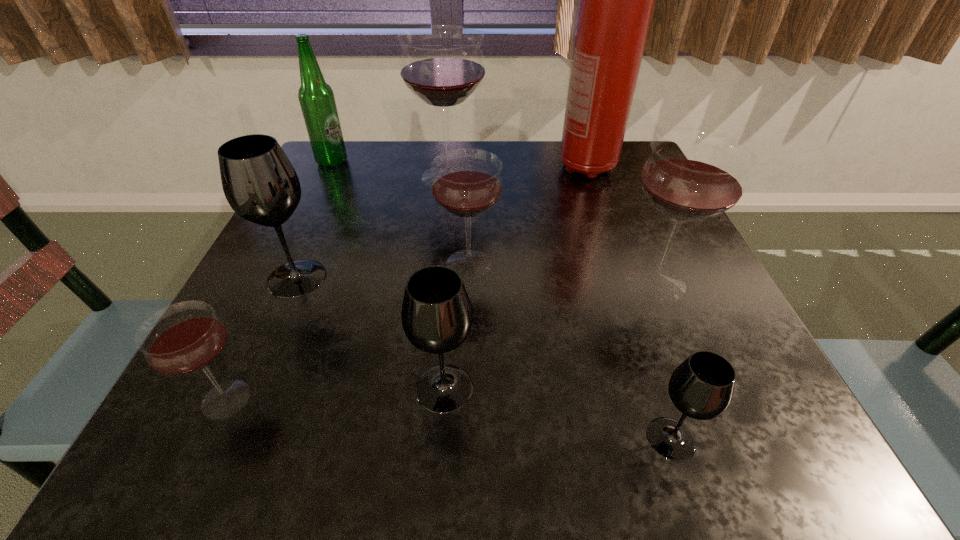
The width and height of the screenshot is (960, 540). Identify the location of fire extinguisher. (616, 4).

Locate an element on the screen. the tallest object is located at coordinates (x=616, y=4).

The image size is (960, 540). In order to click on the farthest red wineglass in this screenshot , I will do `click(442, 65)`.

Image resolution: width=960 pixels, height=540 pixels. I want to click on the tallest wineglass, so click(x=442, y=65).

Identify the location of green beer bottle. This screenshot has width=960, height=540. (316, 97).

The height and width of the screenshot is (540, 960). In order to click on the third smallest red wineglass in this screenshot , I will do `click(692, 175)`.

At what (x,y) coordinates should I click in order to perform the action: click on the leftmost gray wineglass. Please return your answer as a coordinate pair (x, y). Looking at the image, I should click on (259, 182).

The image size is (960, 540). Identify the location of the farthest gray wineglass. (259, 182).

You are a GUI agent. You are given a task and a screenshot of the screen. Output one action in this format:
    pyautogui.click(x=<x>, y=<y>)
    Task: Click on the third biggest red wineglass
    
    Given the screenshot: What is the action you would take?
    pyautogui.click(x=467, y=183)

Locate an element on the screen. the second nearest gray wineglass is located at coordinates (436, 314).